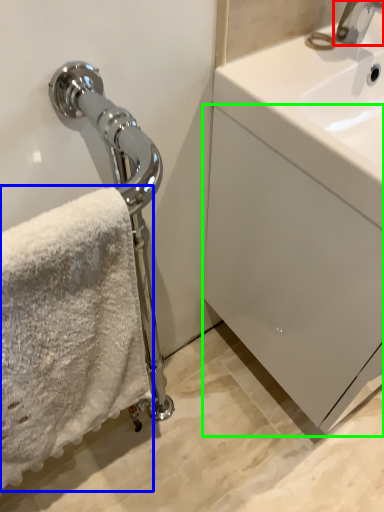
Question: Considering the real-world distances, which object is farthest from tap (highlighted by a red box)? towel (highlighted by a blue box) or drawer (highlighted by a green box)?

Choices:
 (A) towel
 (B) drawer

Answer: (A)